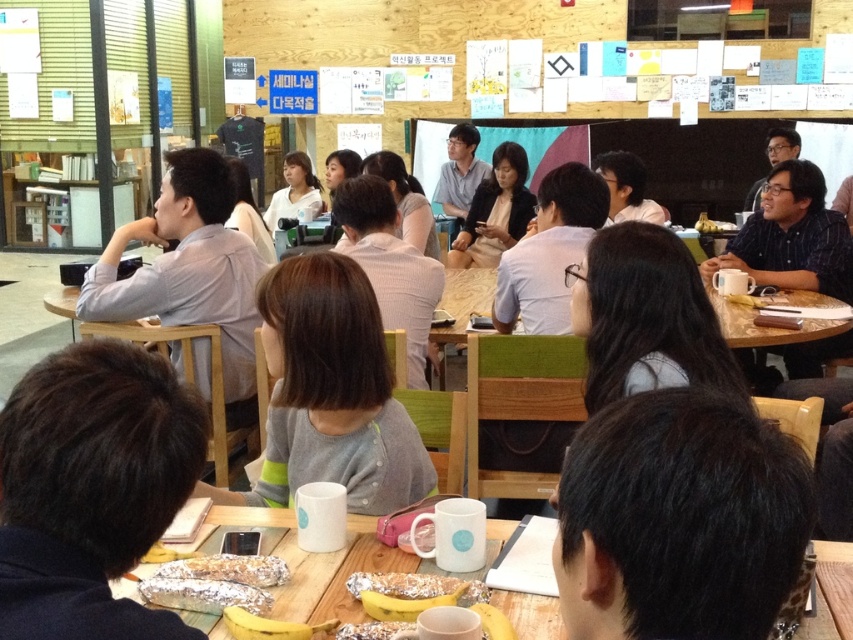
Is black hair at lower right to the left of matte black shirt at center from the viewer's perspective?

No, black hair at lower right is not to the left of matte black shirt at center.

The height and width of the screenshot is (640, 853). Identify the location of black hair at lower right. (679, 520).

Locate an element on the screen. The width and height of the screenshot is (853, 640). black hair at lower right is located at coordinates (679, 520).

Looking at this image, does smooth gray shirt at center have a greater width compared to yellow foil-wrapped banana at lower center?

Correct, the width of smooth gray shirt at center exceeds that of yellow foil-wrapped banana at lower center.

Is smooth gray shirt at center positioned in front of yellow foil-wrapped banana at lower center?

No, smooth gray shirt at center is further to the viewer.

Where is `smooth gray shirt at center`? Image resolution: width=853 pixels, height=640 pixels. smooth gray shirt at center is located at coordinates (646, 312).

Is white matte table at lower center positioned before matte brown bread at center?

Yes, white matte table at lower center is in front of matte brown bread at center.

This screenshot has height=640, width=853. Describe the element at coordinates (308, 561) in the screenshot. I see `white matte table at lower center` at that location.

Is point (308, 620) closer to camera compared to point (705, 212)?

Yes, point (308, 620) is closer to viewer.

At what (x,y) coordinates should I click in order to perform the action: click on white matte table at lower center. Please return your answer as a coordinate pair (x, y). Looking at the image, I should click on [308, 561].